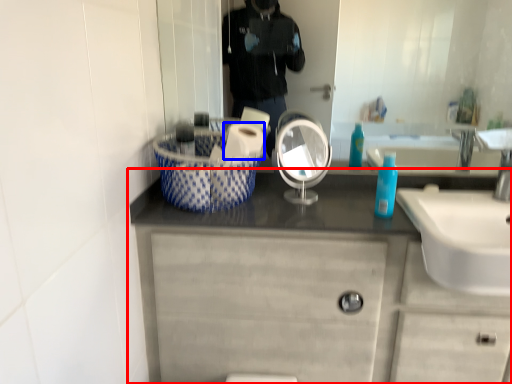
Question: Which object appears farthest to the camera in this image, bathroom cabinet (highlighted by a red box) or toilet paper (highlighted by a blue box)?

Choices:
 (A) bathroom cabinet
 (B) toilet paper

Answer: (B)